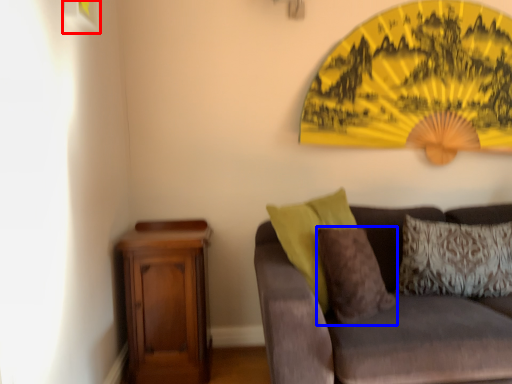
Question: Which object appears farthest to the camera in this image, picture frame (highlighted by a red box) or pillow (highlighted by a blue box)?

Choices:
 (A) picture frame
 (B) pillow

Answer: (B)